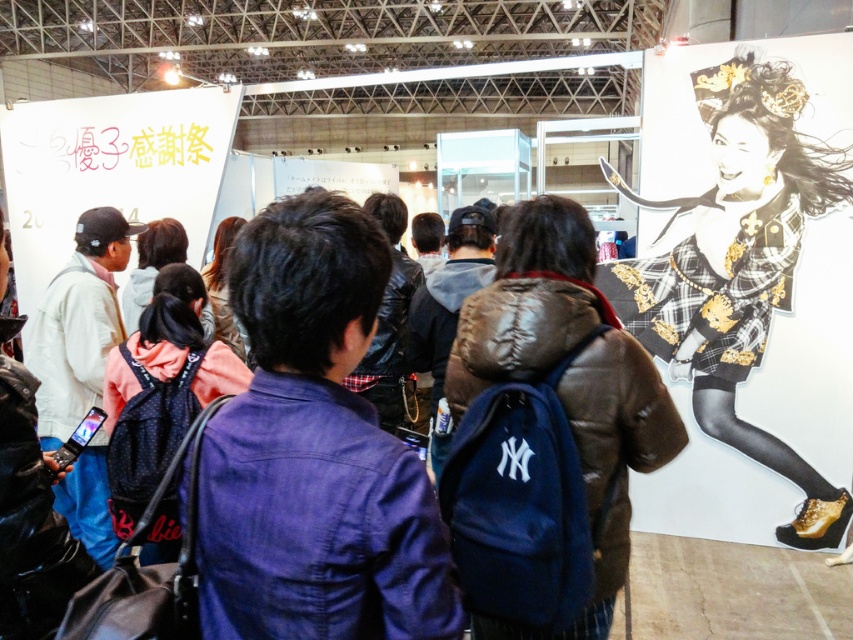
Between denim jacket at center and matte brown jacket at center, which one is positioned lower?

Positioned lower is matte brown jacket at center.

Is point (303, 572) farther from viewer compared to point (628, 364)?

No, (303, 572) is closer to viewer.

Between point (344, 227) and point (573, 250), which one is positioned behind?

The point (573, 250) is behind.

Identify the location of denim jacket at center. The height and width of the screenshot is (640, 853). pos(314,452).